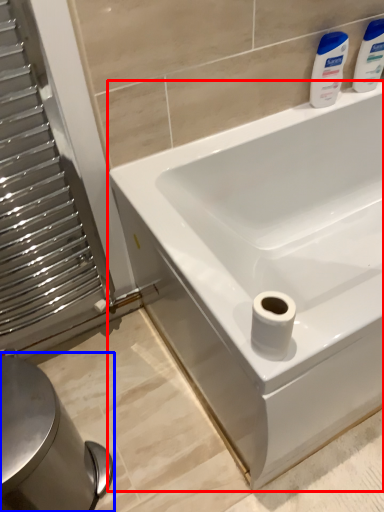
Question: Which object is closer to the camera taking this photo, bathtub (highlighted by a red box) or bidet (highlighted by a blue box)?

Choices:
 (A) bathtub
 (B) bidet

Answer: (A)